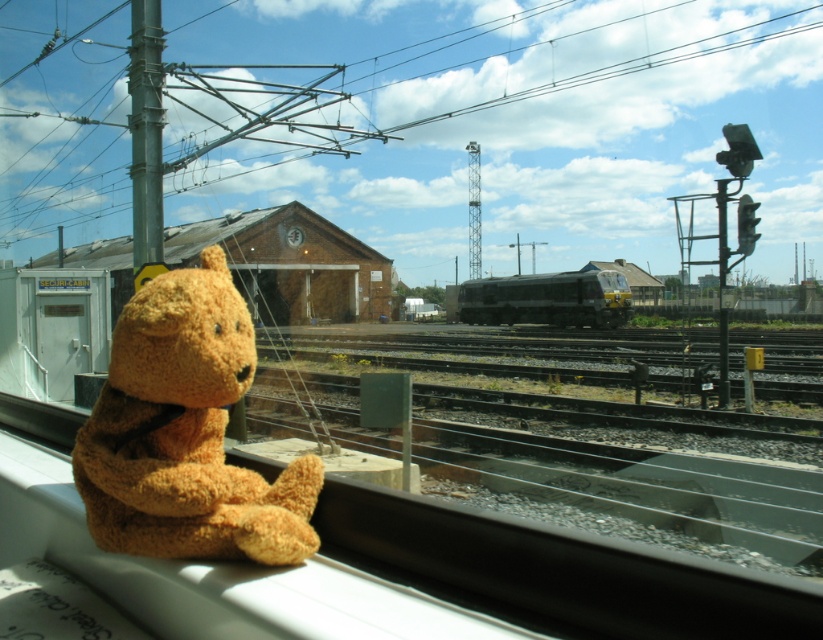
Can you confirm if fuzzy brown teddy bear at left is wider than dark gray metallic train at center?

No.

What do you see at coordinates (184, 433) in the screenshot? The image size is (823, 640). I see `fuzzy brown teddy bear at left` at bounding box center [184, 433].

The width and height of the screenshot is (823, 640). I want to click on fuzzy brown teddy bear at left, so click(x=184, y=433).